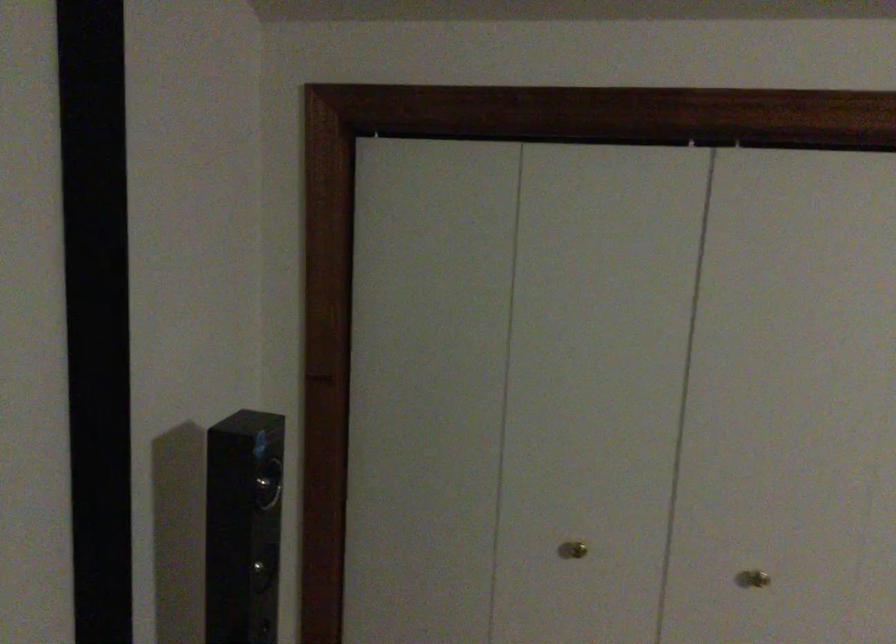
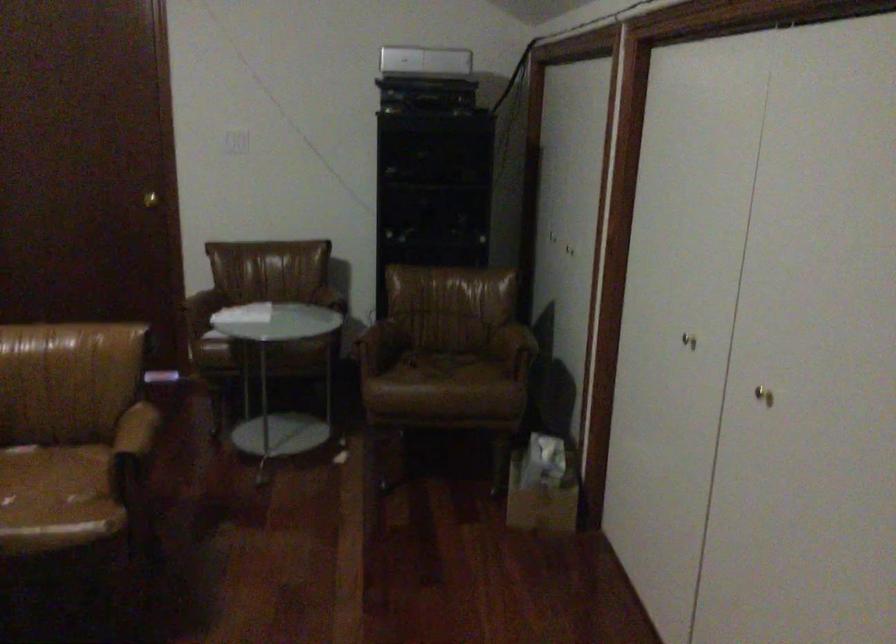
Based on the continuous images, in which direction is the camera rotating?

The rotation direction of the camera is right-down.